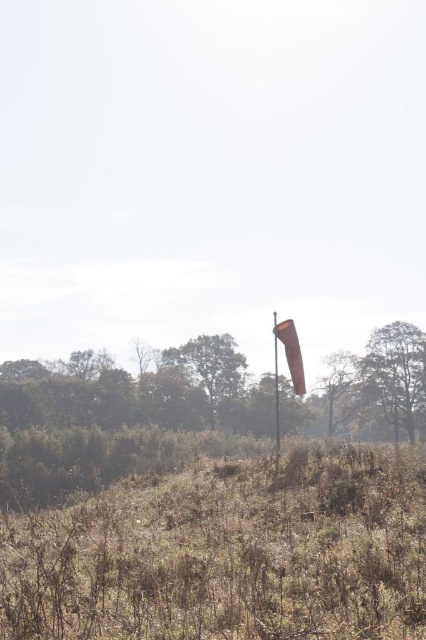
Question: Considering the real-world distances, which object is farthest from the brown fabric flag at center?

Choices:
 (A) brown textured tree at right
 (B) smooth orange flag pole at center
 (C) green leafy tree at center

Answer: (C)

Question: Which of the following is the farthest from the observer?

Choices:
 (A) (284, 337)
 (B) (207, 353)
 (C) (389, 353)

Answer: (B)

Question: Considering the relative positions of brown textured tree at right and green leafy tree at center in the image provided, where is brown textured tree at right located with respect to green leafy tree at center?

Choices:
 (A) left
 (B) right

Answer: (B)

Question: Can you confirm if brown fabric flag at center is positioned above smooth orange flag pole at center?

Choices:
 (A) no
 (B) yes

Answer: (B)

Question: Can you confirm if brown textured tree at right is thinner than brown fabric flag at center?

Choices:
 (A) no
 (B) yes

Answer: (A)

Question: Among these objects, which one is farthest from the camera?

Choices:
 (A) brown fabric flag at center
 (B) green leafy tree at center
 (C) brown textured tree at right

Answer: (B)